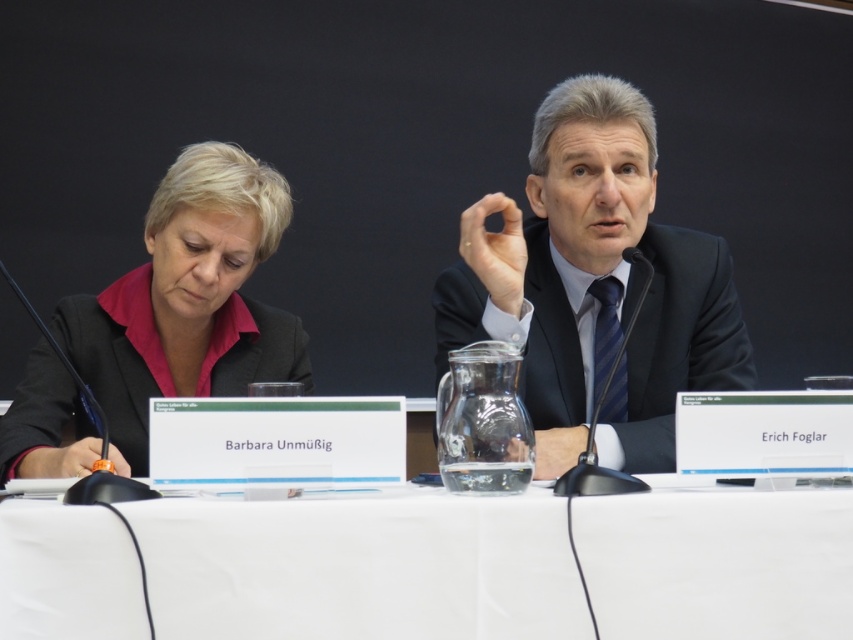
You are organizing a small conference and need to seat two speakers at a table. The white fabric table at center can accommodate the matte black jacket at left. Is the table wide enough to seat both speakers comfortably?

The white fabric table at center is wider than the matte black jacket at left, so it should be wide enough to comfortably seat both speakers.

You are a photographer setting up for a formal event. You need to position a camera stand 20 inches away from the dark blue suit at center. Can you place it on the white fabric table at center? Explain why or why not.

The white fabric table at center is 19.12 inches away from the dark blue suit at center. Since the camera stand needs to be placed 20 inches away, it would be slightly too close if placed on the table. You might need to move it a bit further back or to the side to achieve the required distance.